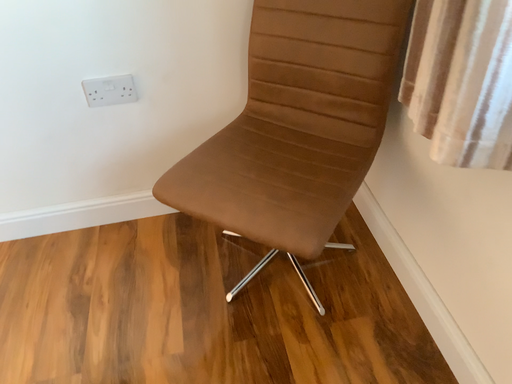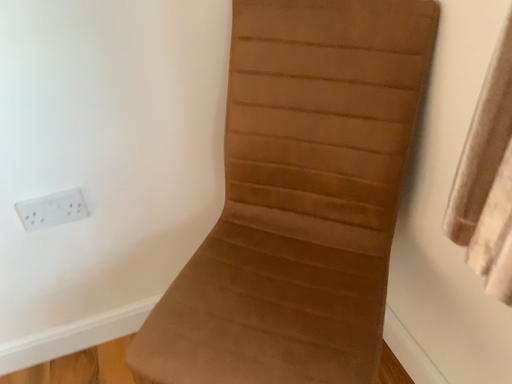
Question: How did the camera likely rotate when shooting the video?

Choices:
 (A) rotated right
 (B) rotated left

Answer: (A)